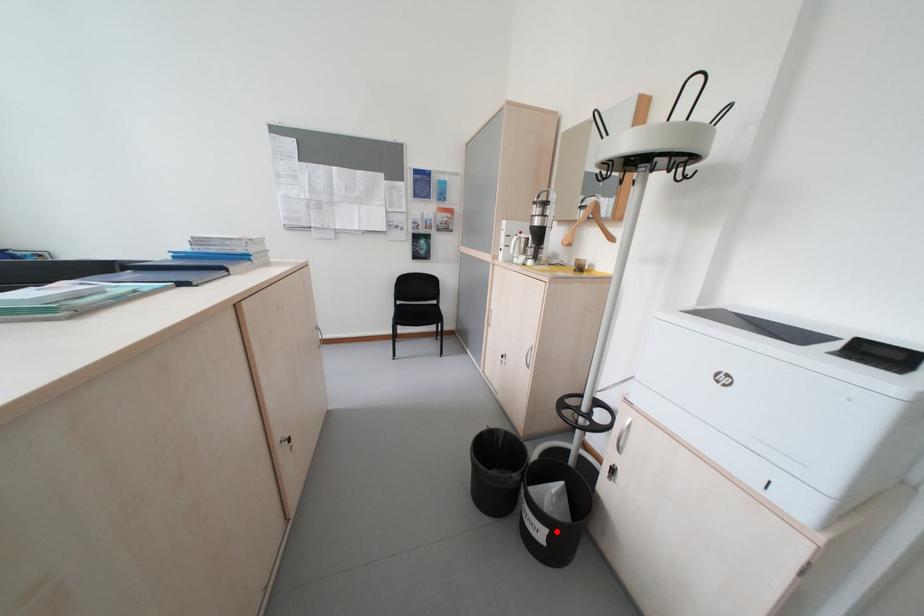
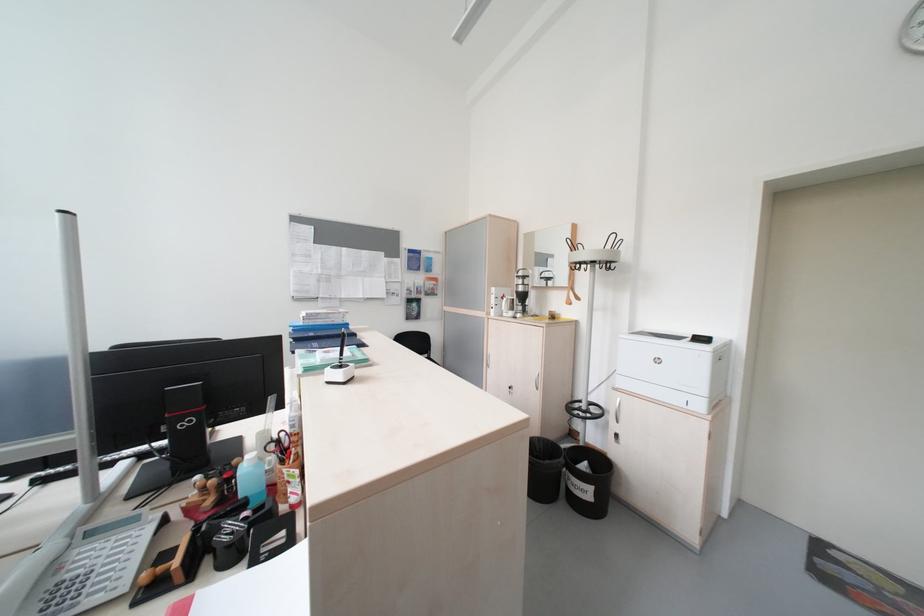
Question: I am providing you with two images of the same scene from different viewpoints. A red point is shown in image1. For the corresponding object point in image2, is it positioned nearer or farther from the camera?

Choices:
 (A) Nearer
 (B) Farther

Answer: (B)